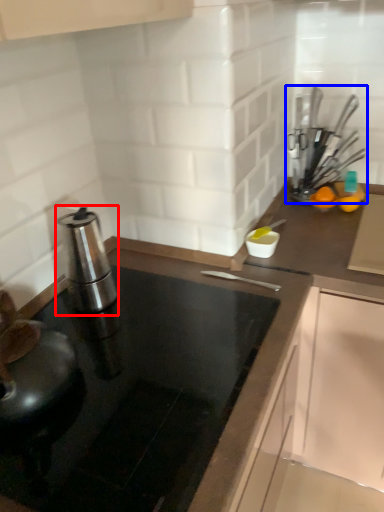
Question: Which object appears farthest to the camera in this image, kitchen appliance (highlighted by a red box) or kitchen appliance (highlighted by a blue box)?

Choices:
 (A) kitchen appliance
 (B) kitchen appliance

Answer: (B)